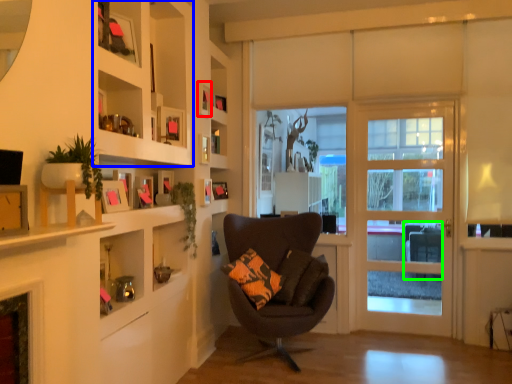
Question: Which object is the farthest from picture frame (highlighted by a red box)? Choose among these: cabinet (highlighted by a blue box) or swivel chair (highlighted by a green box).

Choices:
 (A) cabinet
 (B) swivel chair

Answer: (B)